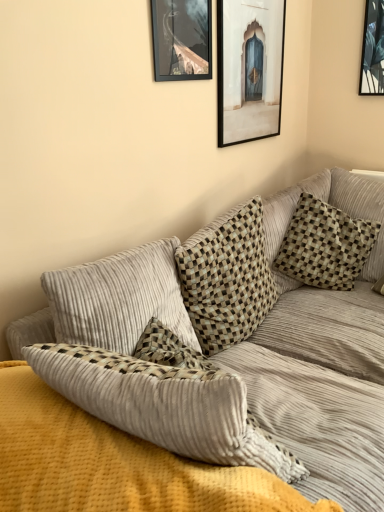
Question: Based on their positions, is matte black picture frame at upper center, which is counted as the 1th picture frame, starting from the front, located to the left or right of matte wooden picture frame at upper center, which is counted as the 1th picture frame, starting from the back?

Choices:
 (A) left
 (B) right

Answer: (A)

Question: From a real-world perspective, is matte black picture frame at upper center, which is the second picture frame in right-to-left order, positioned above or below matte wooden picture frame at upper center, which is counted as the 1th picture frame, starting from the back?

Choices:
 (A) below
 (B) above

Answer: (B)

Question: Which of these objects is positioned closest to the matte wooden picture frame at upper center, marked as the 1th picture frame in a right-to-left arrangement?

Choices:
 (A) checkered fabric pillow at upper right, the 2th pillow positioned from the left
 (B) checkered fabric pillow at center, the first pillow viewed from the left
 (C) corduroy couch at center
 (D) matte black picture frame at upper center, positioned as the first picture frame in left-to-right order

Answer: (D)

Question: Estimate the real-world distances between objects in this image. Which object is closer to the matte wooden picture frame at upper center, which ranks as the second picture frame in left-to-right order?

Choices:
 (A) checkered fabric pillow at upper right, the 2th pillow positioned from the left
 (B) checkered fabric pillow at center, the first pillow viewed from the left
 (C) corduroy couch at center
 (D) matte black picture frame at upper center, which is counted as the 1th picture frame, starting from the front

Answer: (D)